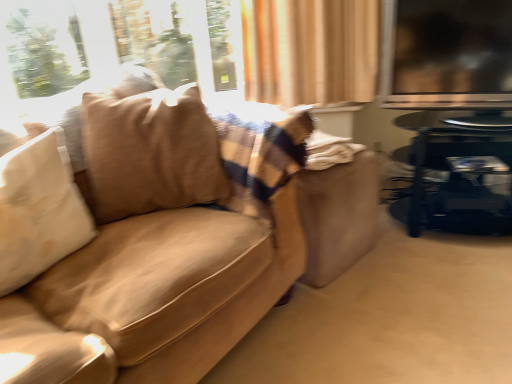
Question: Does brown textured pillow at left have a greater height compared to shiny black table at right?

Choices:
 (A) yes
 (B) no

Answer: (A)

Question: Would you consider brown textured pillow at left to be distant from shiny black table at right?

Choices:
 (A) yes
 (B) no

Answer: (A)

Question: Is brown textured pillow at left facing towards shiny black table at right?

Choices:
 (A) yes
 (B) no

Answer: (B)

Question: Does brown textured pillow at left have a smaller size compared to shiny black table at right?

Choices:
 (A) no
 (B) yes

Answer: (B)

Question: Is the depth of brown textured pillow at left less than that of shiny black table at right?

Choices:
 (A) no
 (B) yes

Answer: (B)

Question: In the image, is brown textured pillow at left positioned in front of or behind transparent glass window screen at upper right?

Choices:
 (A) front
 (B) behind

Answer: (A)

Question: Does point (205, 165) appear closer or farther from the camera than point (404, 31)?

Choices:
 (A) closer
 (B) farther

Answer: (A)

Question: From the image's perspective, is brown textured pillow at left above or below transparent glass window screen at upper right?

Choices:
 (A) below
 (B) above

Answer: (A)

Question: Considering the positions of brown textured pillow at left and transparent glass window screen at upper right in the image, is brown textured pillow at left taller or shorter than transparent glass window screen at upper right?

Choices:
 (A) tall
 (B) short

Answer: (A)

Question: Considering the positions of suede-like beige couch at left and white soft pillow at left in the image, is suede-like beige couch at left taller or shorter than white soft pillow at left?

Choices:
 (A) short
 (B) tall

Answer: (B)

Question: From the image's perspective, is suede-like beige couch at left located above or below white soft pillow at left?

Choices:
 (A) below
 (B) above

Answer: (A)

Question: Based on their positions, is suede-like beige couch at left located to the left or right of white soft pillow at left?

Choices:
 (A) right
 (B) left

Answer: (A)

Question: Considering the positions of point (45, 266) and point (16, 266), is point (45, 266) closer or farther from the camera than point (16, 266)?

Choices:
 (A) closer
 (B) farther

Answer: (B)

Question: From the image's perspective, is shiny black table at right positioned above or below transparent glass window screen at upper right?

Choices:
 (A) above
 (B) below

Answer: (B)

Question: From a real-world perspective, is shiny black table at right above or below transparent glass window screen at upper right?

Choices:
 (A) below
 (B) above

Answer: (A)